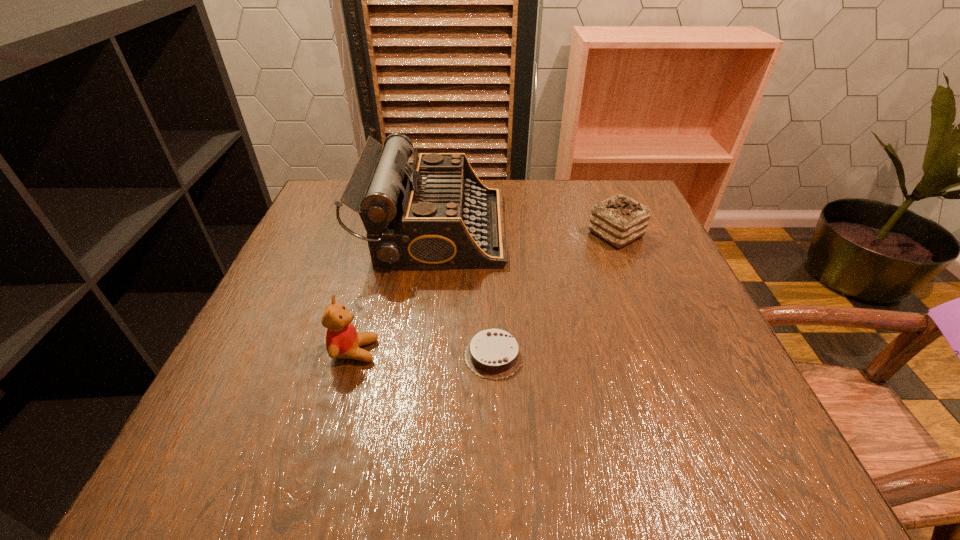
The width and height of the screenshot is (960, 540). I want to click on typewriter that is at the far edge, so click(x=434, y=214).

This screenshot has height=540, width=960. I want to click on chocolate cake that is at the far edge, so click(x=619, y=220).

Where is `object situated at the left edge`? This screenshot has height=540, width=960. object situated at the left edge is located at coordinates (434, 214).

Identify the location of object that is at the right edge. (619, 220).

Identify the location of object that is at the far left corner. The height and width of the screenshot is (540, 960). (434, 214).

Where is `object located in the far right corner section of the desktop`? This screenshot has width=960, height=540. object located in the far right corner section of the desktop is located at coordinates (619, 220).

The width and height of the screenshot is (960, 540). Find the location of `vacant space at the far edge`. vacant space at the far edge is located at coordinates (524, 182).

This screenshot has height=540, width=960. In the image, there is a desktop. In order to click on vacant region at the near edge in this screenshot , I will do `click(391, 461)`.

The width and height of the screenshot is (960, 540). I want to click on free location at the left edge, so click(310, 403).

I want to click on vacant space at the right edge of the desktop, so click(748, 395).